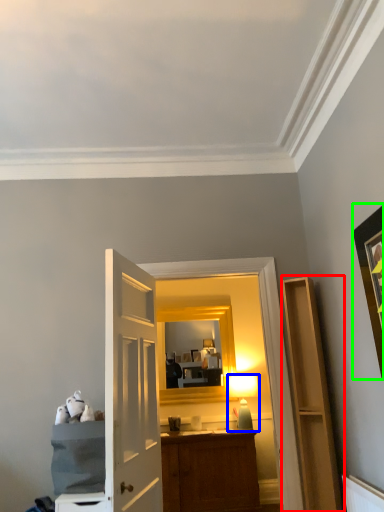
Question: Based on their relative distances, which object is nearer to cabinetry (highlighted by a red box)? Choose from table lamp (highlighted by a blue box) and picture frame (highlighted by a green box).

Choices:
 (A) table lamp
 (B) picture frame

Answer: (B)